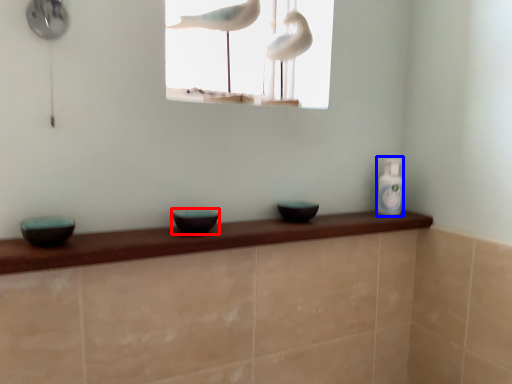
Question: Which object appears farthest to the camera in this image, basin (highlighted by a red box) or bottle (highlighted by a blue box)?

Choices:
 (A) basin
 (B) bottle

Answer: (B)